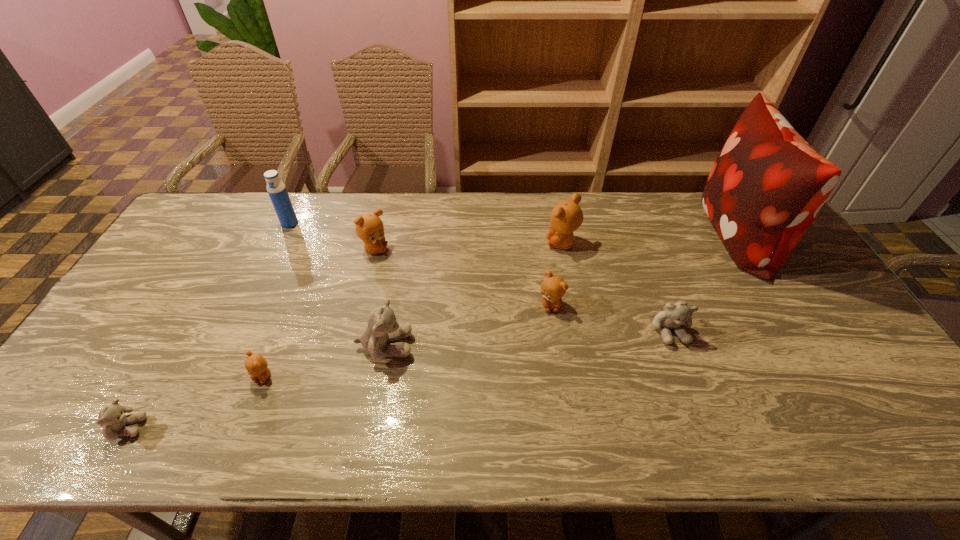
Find the location of a particular element. The width and height of the screenshot is (960, 540). red cushion is located at coordinates coord(765,189).

This screenshot has height=540, width=960. I want to click on the tallest object, so click(765, 189).

Locate an element on the screen. This screenshot has width=960, height=540. the eighth object from right to left is located at coordinates (276, 189).

This screenshot has width=960, height=540. I want to click on blue water bottle, so [276, 189].

Locate an element on the screen. The width and height of the screenshot is (960, 540). the biggest brown teddy bear is located at coordinates (566, 217).

This screenshot has width=960, height=540. In order to click on the third brown teddy bear from right to left in this screenshot , I will do `click(369, 227)`.

Image resolution: width=960 pixels, height=540 pixels. Identify the location of the biggest gray teddy bear. click(382, 327).

This screenshot has height=540, width=960. Find the location of `the second nearest brown teddy bear`. the second nearest brown teddy bear is located at coordinates (553, 288).

At what (x,y) coordinates should I click in order to perform the action: click on the rightmost gray teddy bear. Please return your answer as a coordinate pair (x, y). This screenshot has width=960, height=540. Looking at the image, I should click on (674, 315).

This screenshot has height=540, width=960. Find the location of `the second object from right to left`. the second object from right to left is located at coordinates (674, 315).